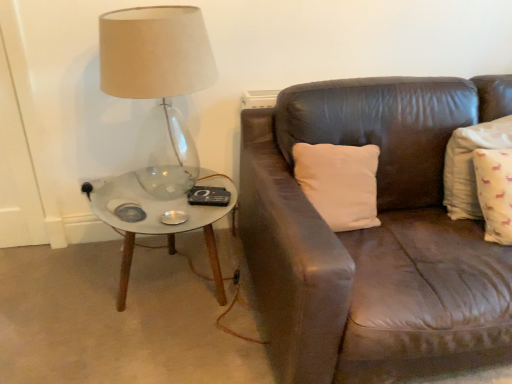
Question: Can you confirm if translucent glass lamp at left is positioned to the left of white marble coffee table at left?

Choices:
 (A) no
 (B) yes

Answer: (A)

Question: Is translucent glass lamp at left aimed at white marble coffee table at left?

Choices:
 (A) yes
 (B) no

Answer: (B)

Question: Can you confirm if translucent glass lamp at left is positioned to the right of white marble coffee table at left?

Choices:
 (A) no
 (B) yes

Answer: (B)

Question: Can you confirm if translucent glass lamp at left is thinner than white marble coffee table at left?

Choices:
 (A) yes
 (B) no

Answer: (A)

Question: Is translucent glass lamp at left further to camera compared to white marble coffee table at left?

Choices:
 (A) yes
 (B) no

Answer: (B)

Question: In the image, is white cotton pillow at right positioned in front of or behind translucent glass lamp at left?

Choices:
 (A) behind
 (B) front

Answer: (A)

Question: Looking at the image, does white cotton pillow at right seem bigger or smaller compared to translucent glass lamp at left?

Choices:
 (A) small
 (B) big

Answer: (A)

Question: Considering the positions of white cotton pillow at right and translucent glass lamp at left in the image, is white cotton pillow at right wider or thinner than translucent glass lamp at left?

Choices:
 (A) wide
 (B) thin

Answer: (B)

Question: Is point (497, 119) positioned closer to the camera than point (147, 150)?

Choices:
 (A) farther
 (B) closer

Answer: (B)

Question: Is white marble coffee table at left wider or thinner than translucent glass lamp at left?

Choices:
 (A) wide
 (B) thin

Answer: (A)

Question: Considering the positions of white marble coffee table at left and translucent glass lamp at left in the image, is white marble coffee table at left taller or shorter than translucent glass lamp at left?

Choices:
 (A) short
 (B) tall

Answer: (A)

Question: From a real-world perspective, is white marble coffee table at left physically located above or below translucent glass lamp at left?

Choices:
 (A) above
 (B) below

Answer: (B)

Question: Considering the positions of point (123, 241) and point (114, 77), is point (123, 241) closer or farther from the camera than point (114, 77)?

Choices:
 (A) closer
 (B) farther

Answer: (B)

Question: Considering their positions, is translucent glass lamp at left located in front of or behind white marble coffee table at left?

Choices:
 (A) behind
 (B) front

Answer: (B)

Question: Is point (166, 148) positioned closer to the camera than point (177, 225)?

Choices:
 (A) farther
 (B) closer

Answer: (A)